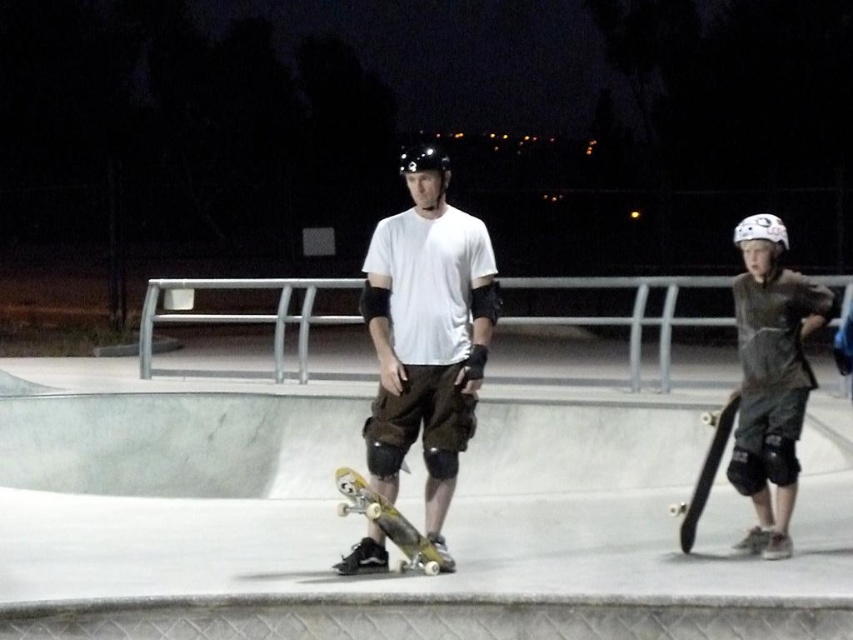
Question: Which of these objects is positioned farthest from the wooden deck skateboard at center?

Choices:
 (A) wooden skateboard at right
 (B) wooden skateboard at center

Answer: (B)

Question: Can you confirm if brushed metal rail at center is positioned to the right of wooden skateboard at right?

Choices:
 (A) no
 (B) yes

Answer: (A)

Question: Is wooden skateboard at center in front of matte white t-shirt at center?

Choices:
 (A) yes
 (B) no

Answer: (A)

Question: Which of the following is the farthest from the observer?

Choices:
 (A) (468, 333)
 (B) (80, 604)

Answer: (A)

Question: Which point appears farthest from the camera in this image?

Choices:
 (A) (457, 262)
 (B) (781, 420)
 (C) (340, 515)
 (D) (704, 420)

Answer: (D)

Question: Does wooden skateboard at center have a smaller size compared to matte black helmet at upper right?

Choices:
 (A) yes
 (B) no

Answer: (B)